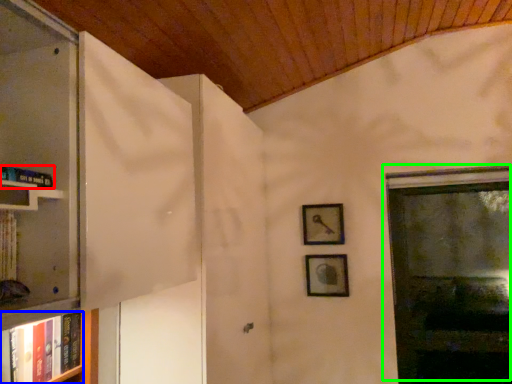
Question: Which is farther away from book (highlighted by a red box)? book (highlighted by a blue box) or window (highlighted by a green box)?

Choices:
 (A) book
 (B) window

Answer: (B)